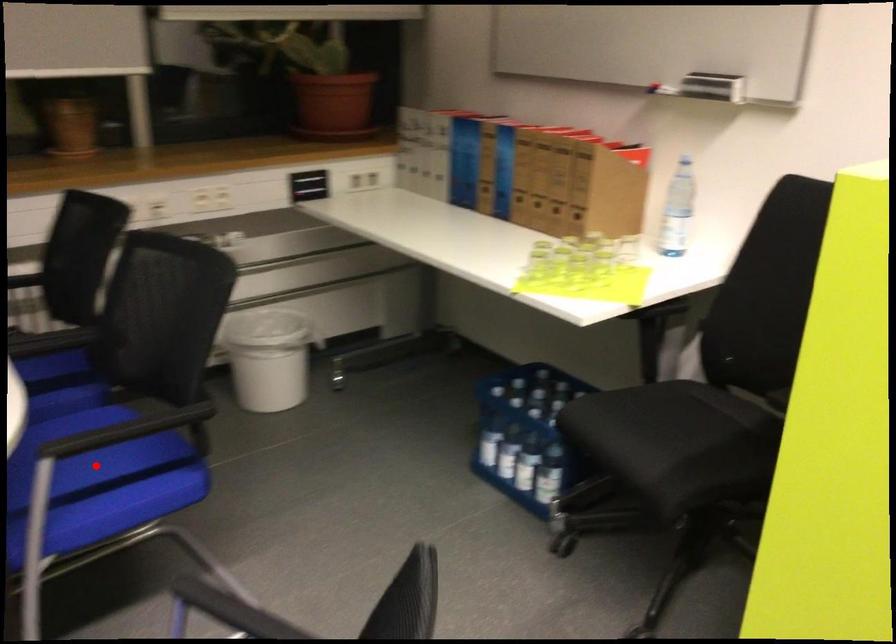
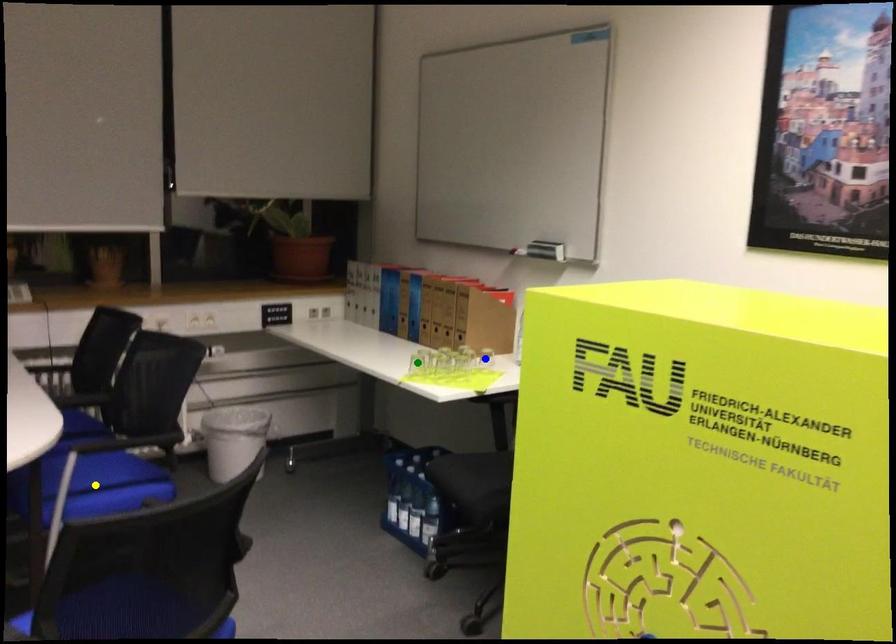
Question: I am providing you with two images of the same scene from different viewpoints. A red point is marked on the first image. You are given multiple points on the second image. Which point in image 2 is actually the same real-world point as the red point in image 1?

Choices:
 (A) yellow point
 (B) green point
 (C) blue point

Answer: (A)